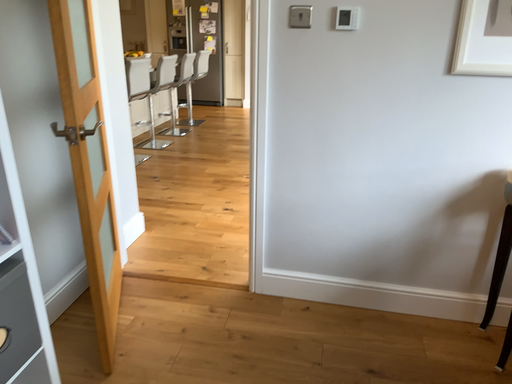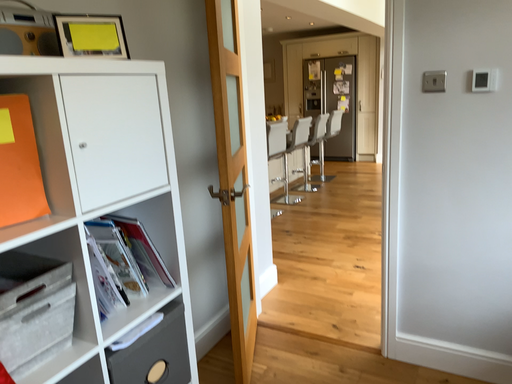
Question: How did the camera likely rotate when shooting the video?

Choices:
 (A) rotated right
 (B) rotated left

Answer: (B)